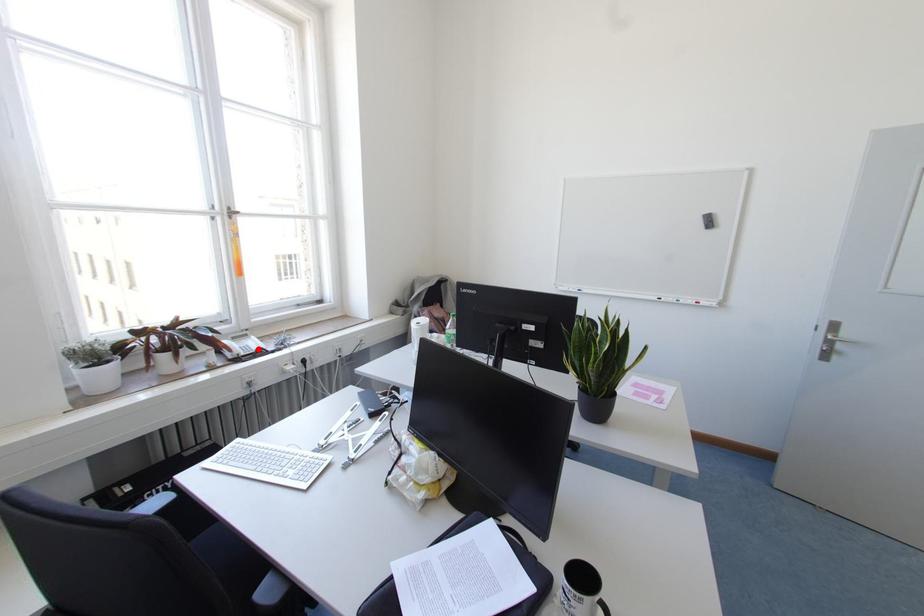
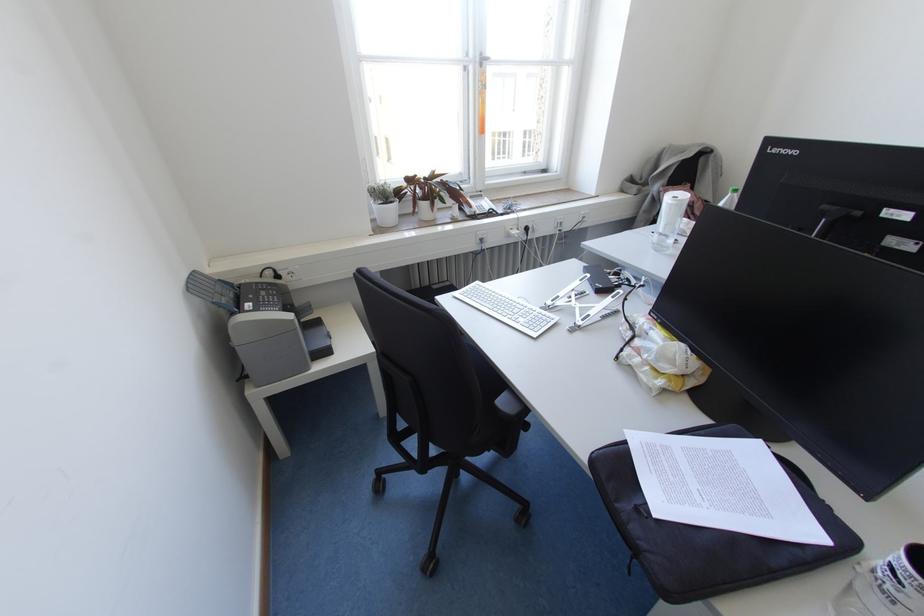
The point at the highlighted location is marked in the first image. Where is the corresponding point in the second image?

(490, 209)